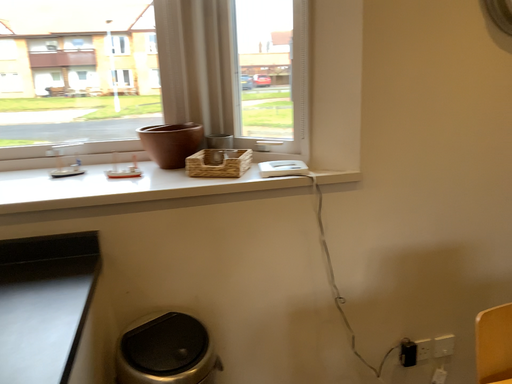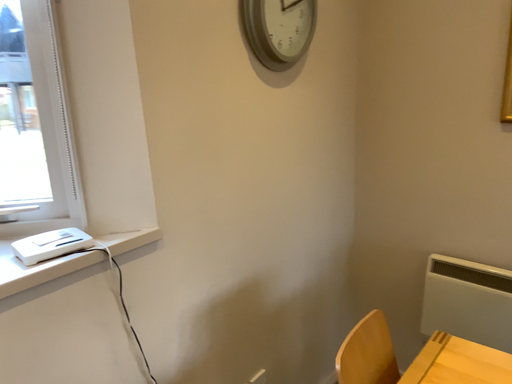
Question: Which way did the camera rotate in the video?

Choices:
 (A) rotated right
 (B) rotated left

Answer: (A)